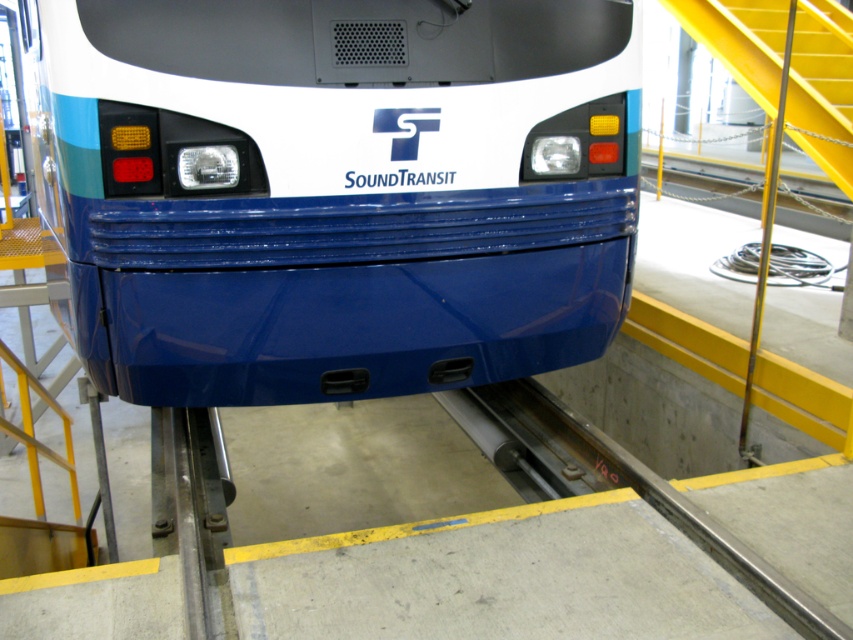
You are a maintenance worker needing to access the roof of the glossy blue train at center. There are yellow metal stairs at upper right nearby. Can you reach the roof using the stairs?

The glossy blue train at center is taller than yellow metal stairs at upper right, so the stairs may not provide sufficient height to reach the roof. Consider using a ladder or taller equipment for safe access.

You are a maintenance worker needing to access the yellow metal stairs at upper right to inspect the glossy blue train at center. Given the space between them, can you safely move from the stairs to the train without any obstruction?

The glossy blue train at center is wider than the yellow metal stairs at upper right, so there should be enough space between them for a maintenance worker to safely move from the stairs to the train without obstruction.